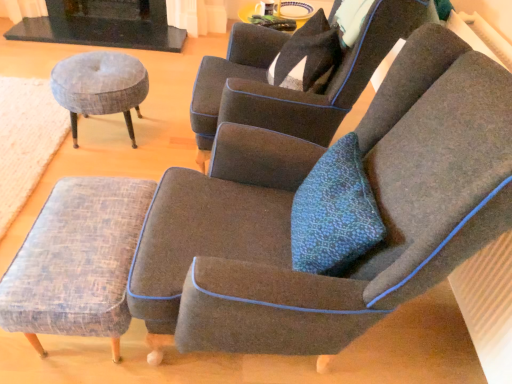
Question: Is point (52, 203) positioned closer to the camera than point (240, 56)?

Choices:
 (A) farther
 (B) closer

Answer: (B)

Question: Is textured gray stool at lower left, marked as the second stool in a top-to-bottom arrangement, situated inside dark gray fabric chair at upper center, the 1th chair in the back-to-front sequence, or outside?

Choices:
 (A) outside
 (B) inside

Answer: (A)

Question: Which is nearer to the black stone fireplace at upper left?

Choices:
 (A) textured gray stool at lower left, which is the second stool in back-to-front order
 (B) woven fabric ottoman at lower left
 (C) dark gray fabric chair at upper center, arranged as the 2th chair when viewed from the front
 (D) textured gray fabric stool at left, placed as the first stool when sorted from top to bottom
 (E) dark gray fabric chair at center, the 2th chair positioned from the back

Answer: (B)

Question: Which is farther from the black stone fireplace at upper left?

Choices:
 (A) textured gray fabric stool at left, placed as the first stool when sorted from top to bottom
 (B) dark gray fabric chair at center, acting as the first chair starting from the front
 (C) dark gray fabric chair at upper center, arranged as the 2th chair when viewed from the front
 (D) textured gray stool at lower left, marked as the second stool in a top-to-bottom arrangement
 (E) woven fabric ottoman at lower left

Answer: (B)